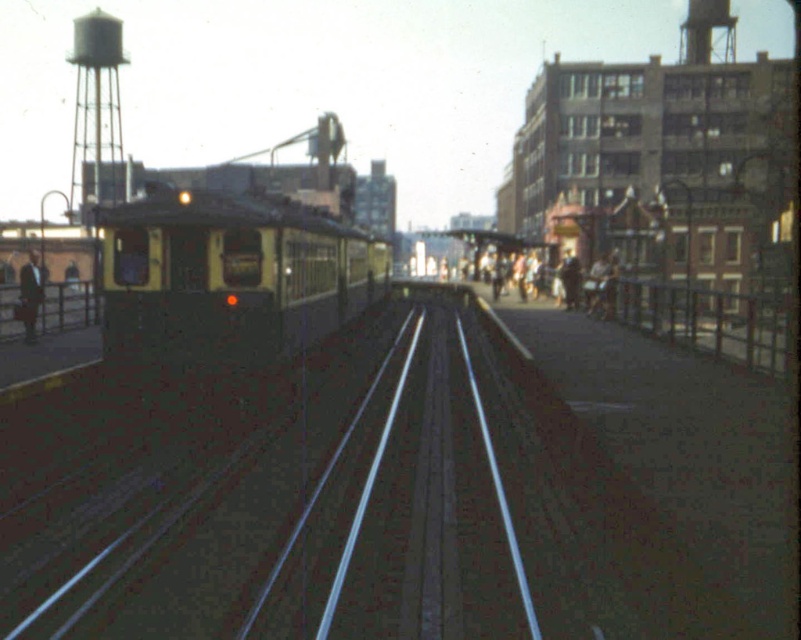
Can you confirm if metallic silver train track at center is positioned to the right of yellow matte train at left?

Correct, you'll find metallic silver train track at center to the right of yellow matte train at left.

Between metallic silver train track at center and yellow matte train at left, which one appears on the left side from the viewer's perspective?

From the viewer's perspective, yellow matte train at left appears more on the left side.

Who is more distant from viewer, (x=437, y=637) or (x=260, y=253)?

Positioned behind is point (x=260, y=253).

I want to click on metallic silver train track at center, so click(x=413, y=502).

Between point (99, 13) and point (19, 278), which one is positioned in front?

Positioned in front is point (19, 278).

Is point (71, 52) farther from camera compared to point (21, 320)?

Yes, it is behind point (21, 320).

Identify the location of white painted metal water tower at upper left. Image resolution: width=801 pixels, height=640 pixels. (97, 112).

Can you confirm if metallic silver train track at center is smaller than matte black suit at left?

Correct, metallic silver train track at center occupies less space than matte black suit at left.

Is metallic silver train track at center bigger than matte black suit at left?

Actually, metallic silver train track at center might be smaller than matte black suit at left.

Which is behind, point (449, 445) or point (18, 316)?

Positioned behind is point (18, 316).

The height and width of the screenshot is (640, 801). I want to click on metallic silver train track at center, so click(413, 502).